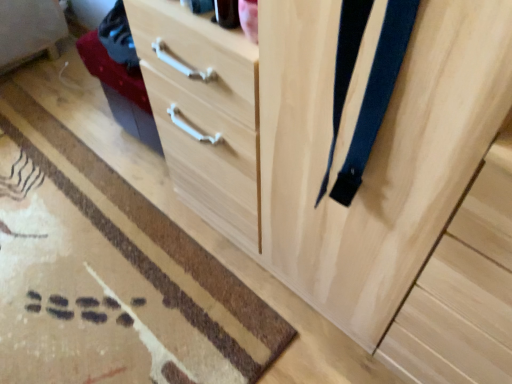
Measure the distance between point (x=75, y=135) and camera.

They are 1.70 meters apart.

Find the location of a particular element. The height and width of the screenshot is (384, 512). brown woven mat at lower left is located at coordinates (161, 230).

The image size is (512, 384). What do you see at coordinates (161, 230) in the screenshot?
I see `brown woven mat at lower left` at bounding box center [161, 230].

The height and width of the screenshot is (384, 512). What do you see at coordinates (376, 94) in the screenshot? I see `dark blue fabric suspenders at right` at bounding box center [376, 94].

The width and height of the screenshot is (512, 384). In order to click on dark blue fabric suspenders at right in this screenshot , I will do `click(376, 94)`.

Where is `brown woven mat at lower left`? brown woven mat at lower left is located at coordinates (161, 230).

Considering the positions of objects brown woven mat at lower left and dark blue fabric suspenders at right in the image provided, who is more to the left, brown woven mat at lower left or dark blue fabric suspenders at right?

From the viewer's perspective, brown woven mat at lower left appears more on the left side.

Considering the positions of objects brown woven mat at lower left and dark blue fabric suspenders at right in the image provided, who is behind, brown woven mat at lower left or dark blue fabric suspenders at right?

→ brown woven mat at lower left is further from the camera.

Does point (185, 249) come closer to viewer compared to point (348, 1)?

No, it is not.

From the image's perspective, is brown woven mat at lower left located beneath dark blue fabric suspenders at right?

Yes.

From a real-world perspective, which object stands above the other?

From a 3D spatial view, dark blue fabric suspenders at right is above.

In the scene shown: Can you confirm if brown woven mat at lower left is thinner than dark blue fabric suspenders at right?

In fact, brown woven mat at lower left might be wider than dark blue fabric suspenders at right.

Based on the photo, considering the sizes of objects brown woven mat at lower left and dark blue fabric suspenders at right in the image provided, who is shorter, brown woven mat at lower left or dark blue fabric suspenders at right?

Standing shorter between the two is brown woven mat at lower left.

Considering the relative sizes of brown woven mat at lower left and dark blue fabric suspenders at right in the image provided, is brown woven mat at lower left smaller than dark blue fabric suspenders at right?

No, brown woven mat at lower left is not smaller than dark blue fabric suspenders at right.

Is brown woven mat at lower left outside of dark blue fabric suspenders at right?

Absolutely, brown woven mat at lower left is external to dark blue fabric suspenders at right.

Is brown woven mat at lower left with dark blue fabric suspenders at right?

No, brown woven mat at lower left is not with dark blue fabric suspenders at right.

Is brown woven mat at lower left oriented away from dark blue fabric suspenders at right?

No, dark blue fabric suspenders at right is not at the back of brown woven mat at lower left.

How many degrees apart are the facing directions of brown woven mat at lower left and dark blue fabric suspenders at right?

91.6 degrees.

How distant is brown woven mat at lower left from dark blue fabric suspenders at right?

32.29 inches.

The height and width of the screenshot is (384, 512). I want to click on suspenders that is in front of the brown woven mat at lower left, so click(376, 94).

Considering the relative positions of dark blue fabric suspenders at right and brown woven mat at lower left in the image provided, is dark blue fabric suspenders at right to the right of brown woven mat at lower left from the viewer's perspective?

Indeed, dark blue fabric suspenders at right is positioned on the right side of brown woven mat at lower left.

Which object is further away from the camera taking this photo, dark blue fabric suspenders at right or brown woven mat at lower left?

brown woven mat at lower left is further from the camera.

Considering the positions of point (371, 70) and point (206, 268), is point (371, 70) closer or farther from the camera than point (206, 268)?

Clearly, point (371, 70) is closer to the camera than point (206, 268).

From the image's perspective, between dark blue fabric suspenders at right and brown woven mat at lower left, which one is located above?

From the image's view, dark blue fabric suspenders at right is above.

Based on the photo, from a real-world perspective, which object stands above the other?

In real-world perspective, dark blue fabric suspenders at right is above.

Is dark blue fabric suspenders at right thinner than brown woven mat at lower left?

Indeed, dark blue fabric suspenders at right has a lesser width compared to brown woven mat at lower left.

Can you confirm if dark blue fabric suspenders at right is taller than brown woven mat at lower left?

Yes.

Between dark blue fabric suspenders at right and brown woven mat at lower left, which one has smaller size?

With smaller size is dark blue fabric suspenders at right.

Would you say dark blue fabric suspenders at right is inside or outside brown woven mat at lower left?

dark blue fabric suspenders at right cannot be found inside brown woven mat at lower left.

Would you consider dark blue fabric suspenders at right to be distant from brown woven mat at lower left?

dark blue fabric suspenders at right is near brown woven mat at lower left, not far away.

Is dark blue fabric suspenders at right positioned with its back to brown woven mat at lower left?

No, dark blue fabric suspenders at right is not facing the opposite direction of brown woven mat at lower left.

Measure the distance between dark blue fabric suspenders at right and brown woven mat at lower left.

dark blue fabric suspenders at right is 32.29 inches from brown woven mat at lower left.

The image size is (512, 384). In order to click on suspenders on the right of brown woven mat at lower left in this screenshot , I will do `click(376, 94)`.

You are a GUI agent. You are given a task and a screenshot of the screen. Output one action in this format:
    pyautogui.click(x=<x>, y=<y>)
    Task: Click on the suspenders above the brown woven mat at lower left (from a real-world perspective)
    
    Given the screenshot: What is the action you would take?
    pyautogui.click(x=376, y=94)

Image resolution: width=512 pixels, height=384 pixels. I want to click on doormat on the left of dark blue fabric suspenders at right, so click(x=161, y=230).